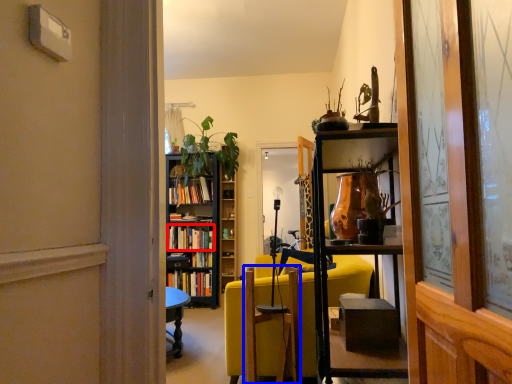
Question: Which object appears farthest to the camera in this image, book (highlighted by a red box) or swivel chair (highlighted by a blue box)?

Choices:
 (A) book
 (B) swivel chair

Answer: (A)